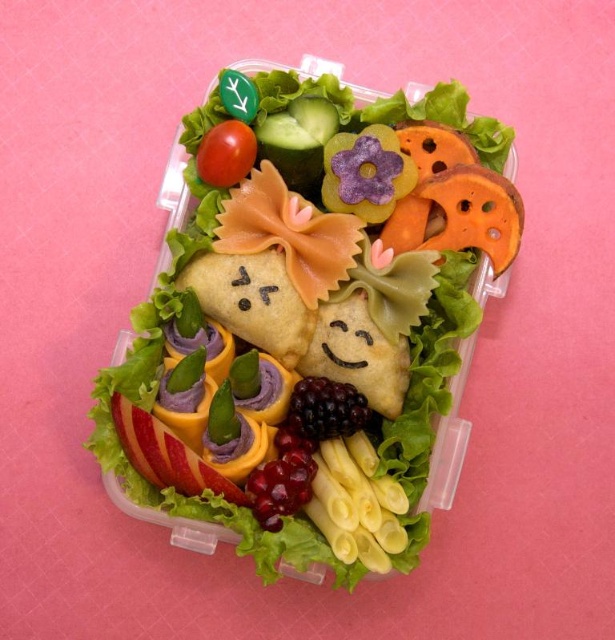
Question: Can you confirm if smooth green lettuce at center is positioned below blackberry at center?

Choices:
 (A) yes
 (B) no

Answer: (B)

Question: Is smooth green lettuce at center in front of blackberry at center?

Choices:
 (A) no
 (B) yes

Answer: (B)

Question: Which object appears farthest from the camera in this image?

Choices:
 (A) blackberry at center
 (B) red smooth tomato at upper left

Answer: (B)

Question: Which of the following is the farthest from the observer?

Choices:
 (A) blackberry at center
 (B) red smooth tomato at upper left

Answer: (B)

Question: Which object is positioned farthest from the red smooth tomato at upper left?

Choices:
 (A) blackberry at center
 (B) smooth green lettuce at center

Answer: (A)

Question: Can you confirm if smooth green lettuce at center is positioned below blackberry at center?

Choices:
 (A) yes
 (B) no

Answer: (B)